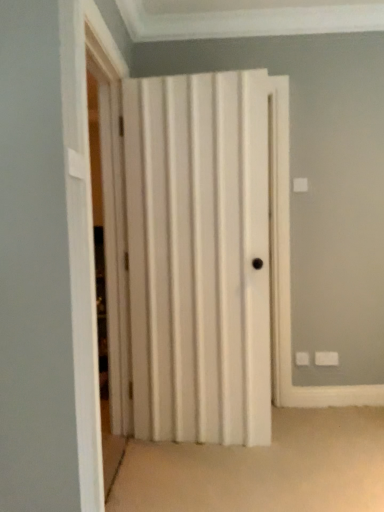
Identify the location of free space in front of white matte door at center. Image resolution: width=384 pixels, height=512 pixels. (226, 480).